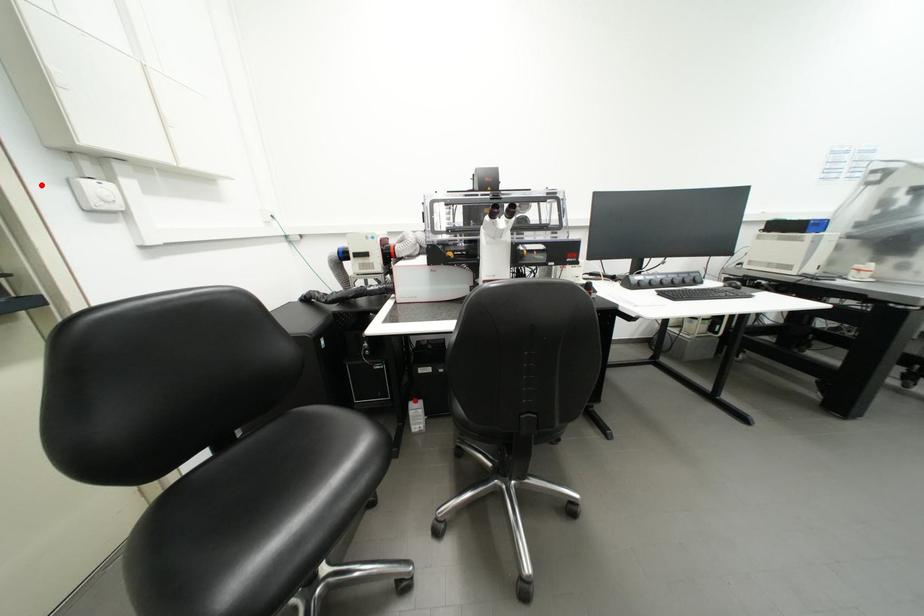
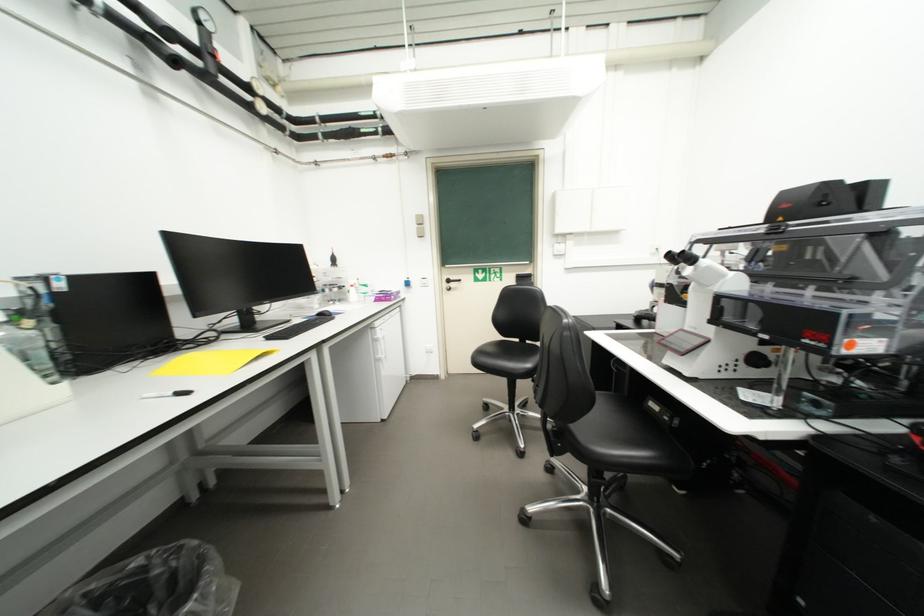
Question: I am providing you with two images of the same scene from different viewpoints. Given a red point in image1, look at the same physical point in image2. Is it:

Choices:
 (A) Closer to the viewpoint
 (B) Farther from the viewpoint

Answer: (A)